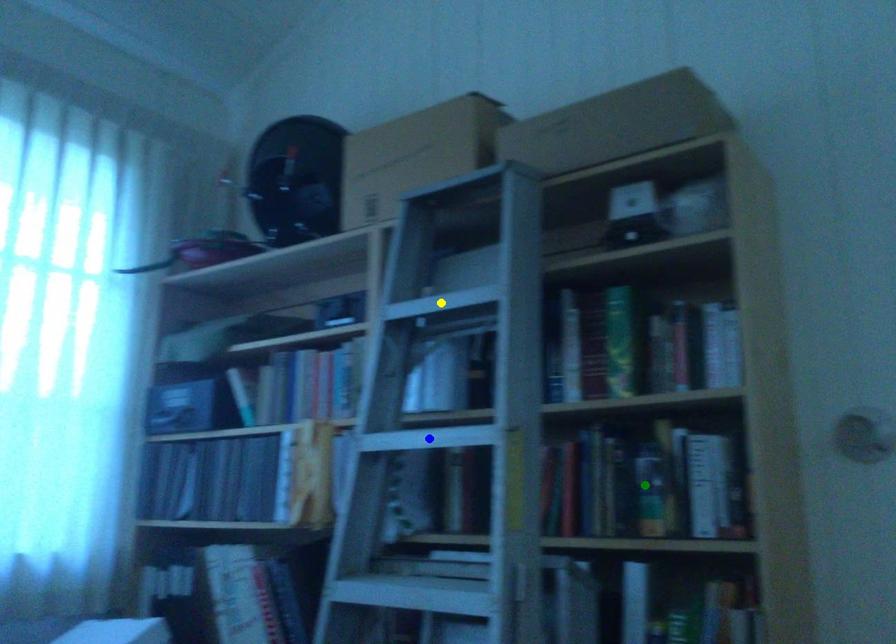
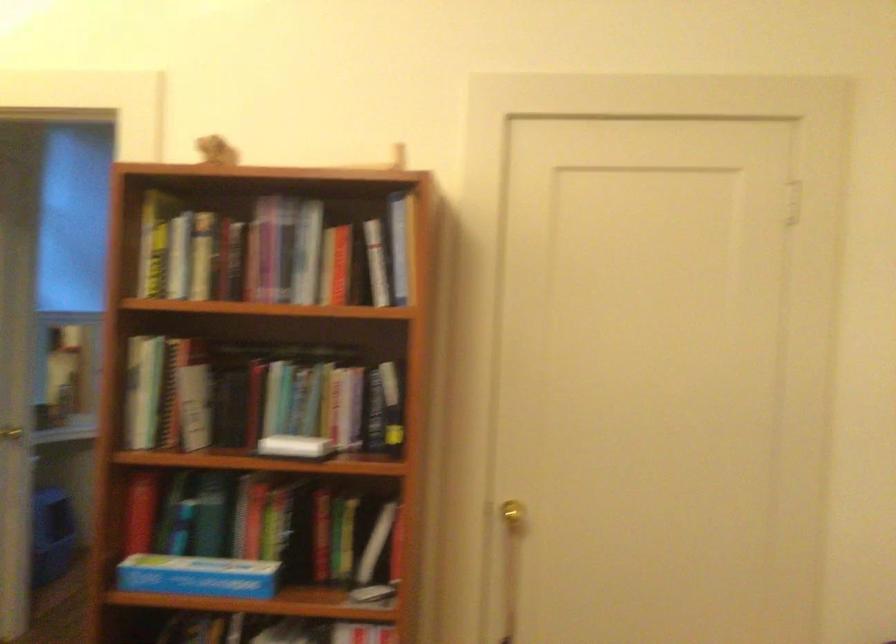
I am providing you with two images of the same scene from different viewpoints. Three points are marked in image1. Which point corresponds to a part or object that is occluded in image2?In image1, three points are marked. Which of them correspond to a part or object that is occluded in image2?Among the three points shown in image1, which one corresponds to a part or object that is no longer visible due to occlusion in image2?

yellow point, green point, blue point